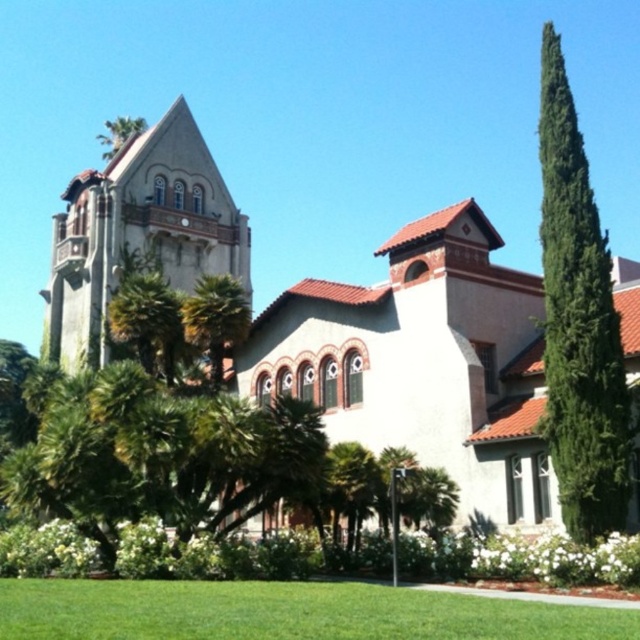
Does white stucco church at center have a lesser width compared to green grass at lower center?

Incorrect, white stucco church at center's width is not less than green grass at lower center's.

Is point (346, 340) farther from viewer compared to point (81, 600)?

Yes, point (346, 340) is behind point (81, 600).

Find the location of a particular element. white stucco church at center is located at coordinates (422, 362).

Who is positioned more to the left, green coniferous tree at right or green leafy palm tree at center?

green leafy palm tree at center

You are a GUI agent. You are given a task and a screenshot of the screen. Output one action in this format:
    pyautogui.click(x=<x>, y=<y>)
    Task: Click on the green coniferous tree at right
    The image size is (640, 640).
    Given the screenshot: What is the action you would take?
    pyautogui.click(x=579, y=323)

Where is `green coniferous tree at right`? green coniferous tree at right is located at coordinates (579, 323).

You are a GUI agent. You are given a task and a screenshot of the screen. Output one action in this format:
    pyautogui.click(x=<x>, y=<y>)
    Task: Click on the green coniferous tree at right
    The image size is (640, 640).
    Given the screenshot: What is the action you would take?
    pyautogui.click(x=579, y=323)

Based on the photo, between green grass at lower center and green coniferous tree at right, which one has less height?

With less height is green grass at lower center.

What do you see at coordinates (285, 612) in the screenshot?
I see `green grass at lower center` at bounding box center [285, 612].

Locate an element on the screen. Image resolution: width=640 pixels, height=640 pixels. green grass at lower center is located at coordinates (285, 612).